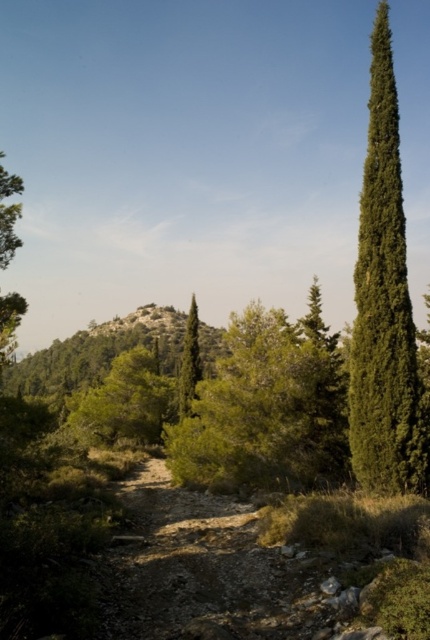
Does dusty gravel trail at center have a lesser width compared to green textured tree at right?

No, dusty gravel trail at center is not thinner than green textured tree at right.

Can you confirm if dusty gravel trail at center is positioned to the left of green textured tree at right?

Indeed, dusty gravel trail at center is positioned on the left side of green textured tree at right.

Which is behind, point (143, 573) or point (414, 420)?

The point (414, 420) is behind.

The height and width of the screenshot is (640, 430). Find the location of `dusty gravel trail at center`. dusty gravel trail at center is located at coordinates (203, 572).

Does green textured tree at right have a greater width compared to green textured tree at center?

In fact, green textured tree at right might be narrower than green textured tree at center.

Does point (390, 227) lie behind point (193, 323)?

No, (390, 227) is in front of (193, 323).

The height and width of the screenshot is (640, 430). I want to click on green textured tree at right, so click(x=383, y=305).

Between dusty gravel trail at center and green textured tree at center, which one is positioned higher?

dusty gravel trail at center is higher up.

Based on the photo, between dusty gravel trail at center and green textured tree at center, which one appears on the left side from the viewer's perspective?

From the viewer's perspective, green textured tree at center appears more on the left side.

Describe the element at coordinates (203, 572) in the screenshot. I see `dusty gravel trail at center` at that location.

Image resolution: width=430 pixels, height=640 pixels. I want to click on dusty gravel trail at center, so click(x=203, y=572).